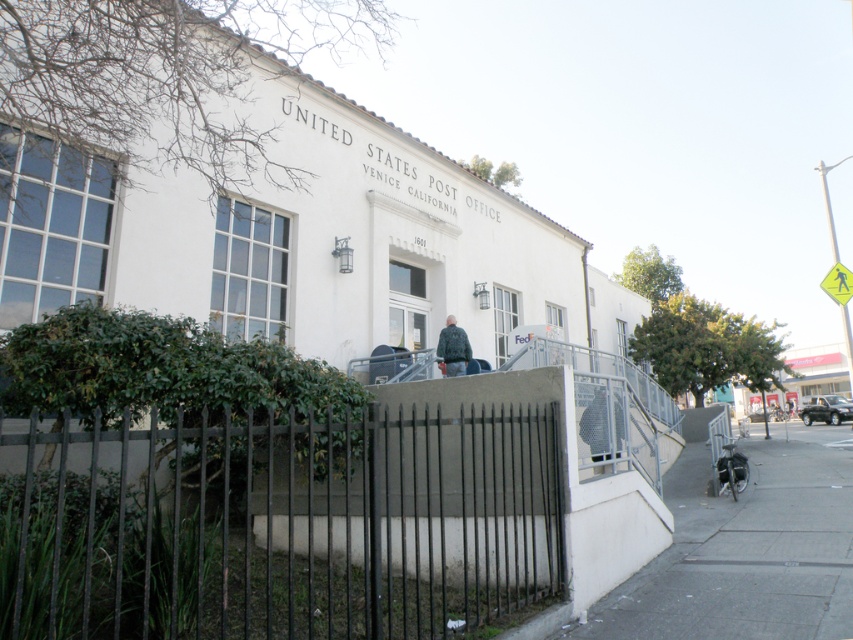
In the scene shown: Who is lower down, leather jacket at center or yellow reflective plastic pedestrian crossing sign at upper right?

leather jacket at center is lower down.

Locate an element on the screen. leather jacket at center is located at coordinates (451, 348).

Which of these two, black metal fence at lower center or leather jacket at center, stands taller?

With more height is black metal fence at lower center.

Is black metal fence at lower center smaller than leather jacket at center?

No.

You are a GUI agent. You are given a task and a screenshot of the screen. Output one action in this format:
    pyautogui.click(x=<x>, y=<y>)
    Task: Click on the black metal fence at lower center
    This screenshot has height=640, width=853.
    Given the screenshot: What is the action you would take?
    pyautogui.click(x=281, y=525)

Does black metal fence at lower center appear under gray concrete sidewalk at lower right?

Actually, black metal fence at lower center is above gray concrete sidewalk at lower right.

Is black metal fence at lower center closer to camera compared to gray concrete sidewalk at lower right?

Yes, black metal fence at lower center is closer to the viewer.

Between point (45, 593) and point (706, 630), which one is positioned in front?

Point (45, 593) is more forward.

This screenshot has height=640, width=853. I want to click on black metal fence at lower center, so pyautogui.click(x=281, y=525).